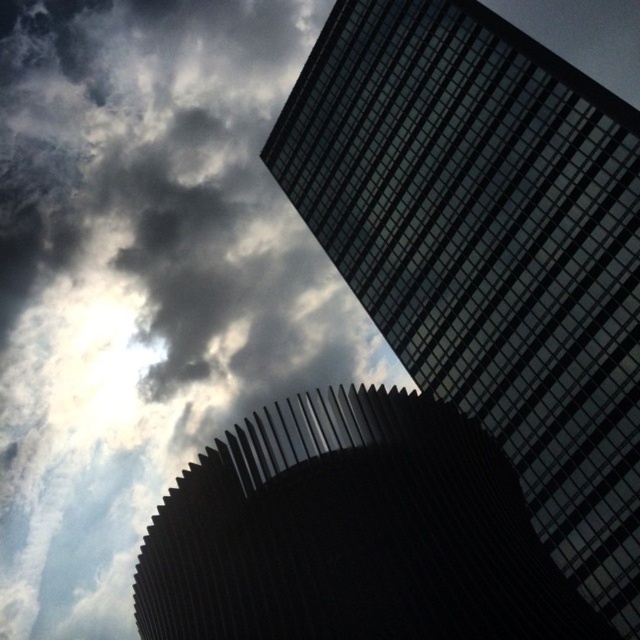
Between cloudy sky at upper left and rough metal structure at lower center, which one appears on the left side from the viewer's perspective?

Positioned to the left is cloudy sky at upper left.

Looking at this image, can you confirm if cloudy sky at upper left is positioned to the right of rough metal structure at lower center?

In fact, cloudy sky at upper left is to the left of rough metal structure at lower center.

Who is more distant from viewer, (x=179, y=138) or (x=211, y=541)?

Positioned behind is point (x=179, y=138).

This screenshot has width=640, height=640. Identify the location of cloudy sky at upper left. (141, 278).

Is point (413, 8) farther from viewer compared to point (291, 630)?

That is True.

The width and height of the screenshot is (640, 640). I want to click on glassy reflective skyscraper at upper right, so click(x=490, y=250).

Where is `glassy reflective skyscraper at upper right`? This screenshot has width=640, height=640. glassy reflective skyscraper at upper right is located at coordinates (490, 250).

The image size is (640, 640). What do you see at coordinates (141, 278) in the screenshot?
I see `cloudy sky at upper left` at bounding box center [141, 278].

Can you confirm if cloudy sky at upper left is positioned to the right of glassy reflective skyscraper at upper right?

No, cloudy sky at upper left is not to the right of glassy reflective skyscraper at upper right.

Which is in front, point (54, 131) or point (452, 106)?

Point (452, 106) is more forward.

Locate an element on the screen. The image size is (640, 640). cloudy sky at upper left is located at coordinates (141, 278).